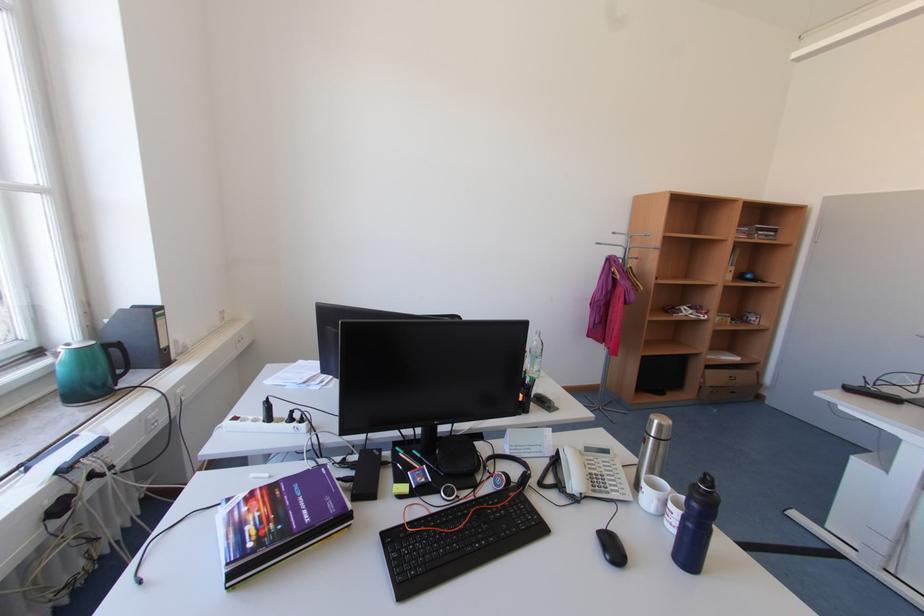
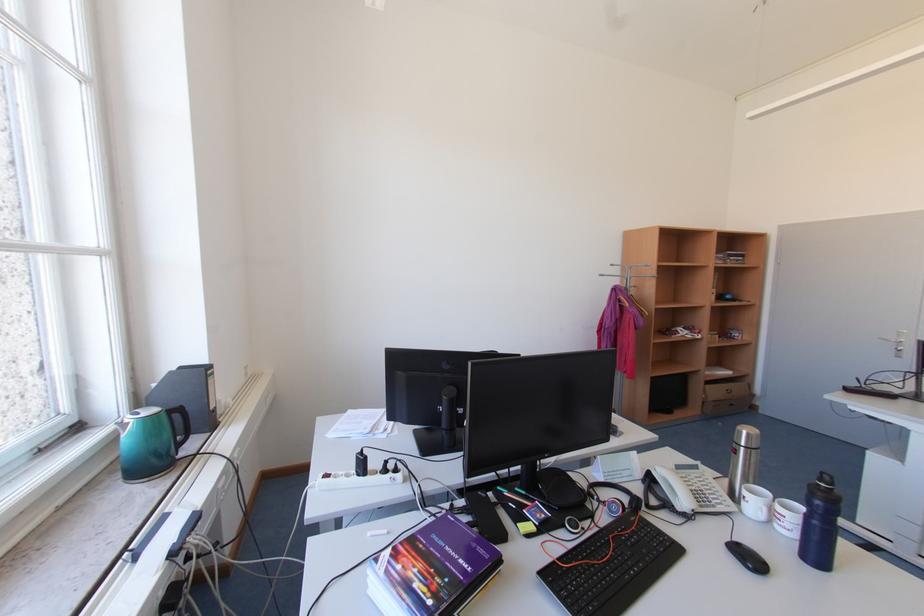
Where in the second image is the point corresponding to (698,525) from the first image?

(824, 524)